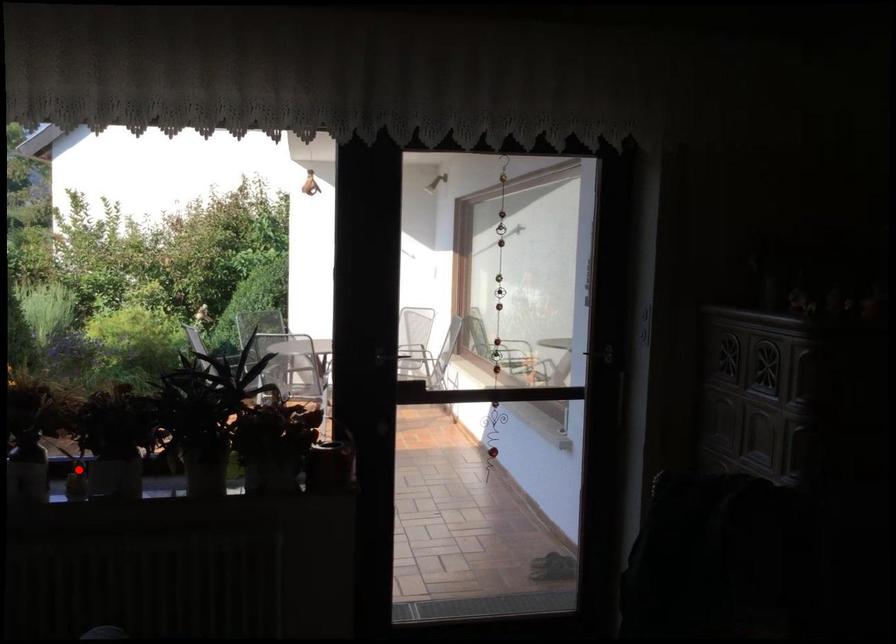
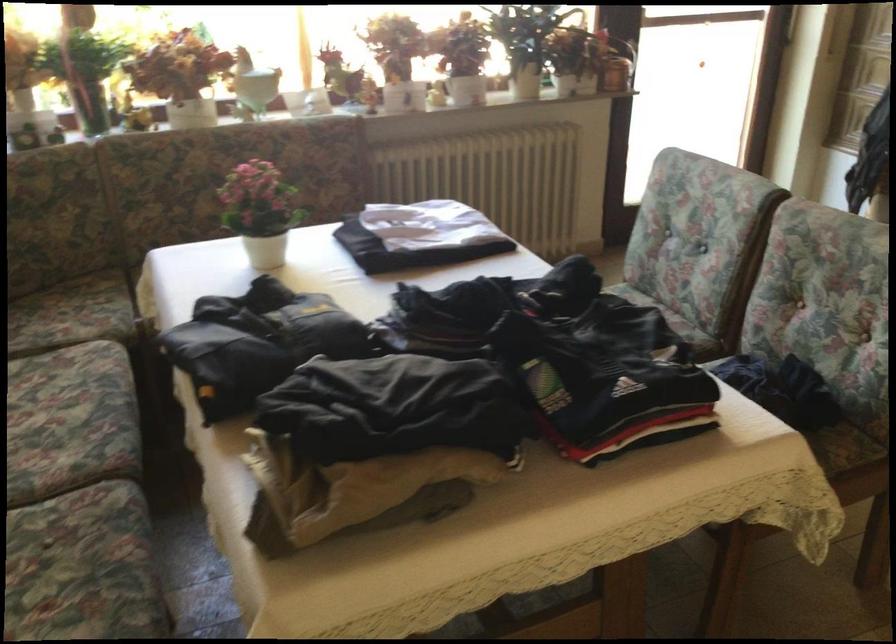
Question: I am providing you with two images of the same scene from different viewpoints. A red point is shown in image1. For the corresponding object point in image2, is it positioned nearer or farther from the camera?

Choices:
 (A) Nearer
 (B) Farther

Answer: (B)